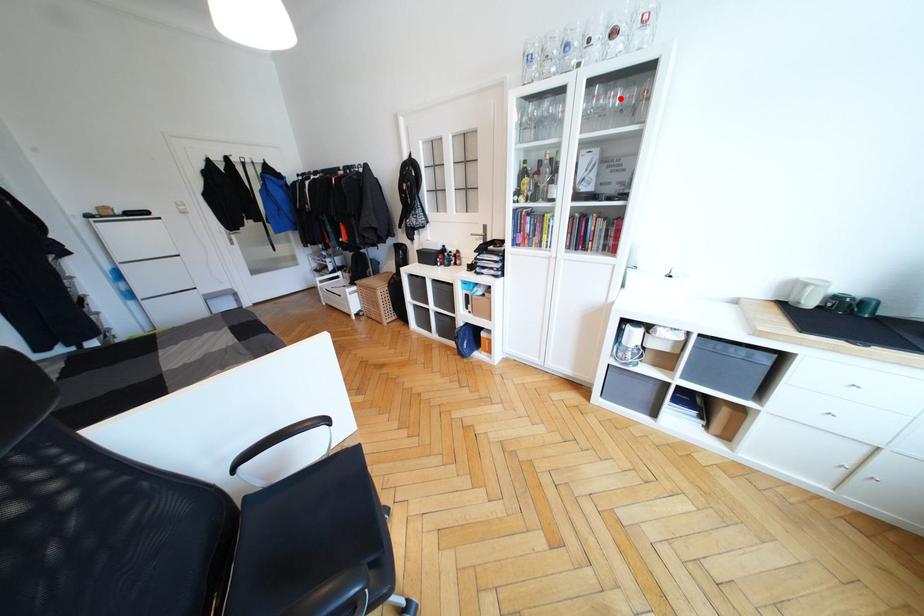
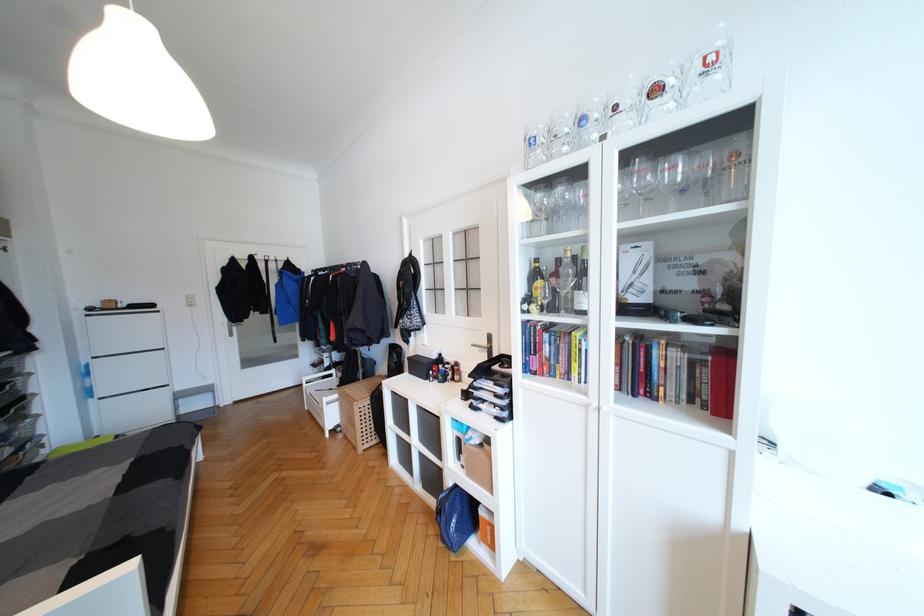
In the second image, find the point that corresponds to the highlighted location in the first image.

(679, 171)